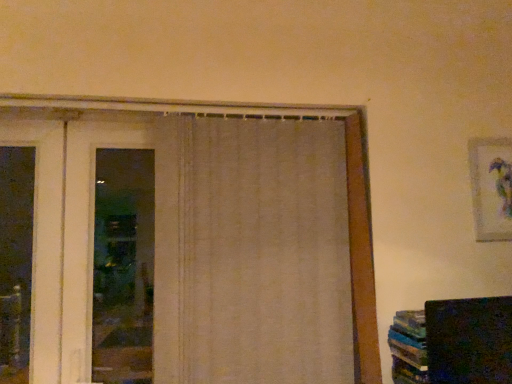
Question: From the image's perspective, is beige fabric curtain at center above or below white fabric door at left?

Choices:
 (A) below
 (B) above

Answer: (A)

Question: Considering their positions, is beige fabric curtain at center located in front of or behind white fabric door at left?

Choices:
 (A) behind
 (B) front

Answer: (B)

Question: Which of these objects is positioned closest to the white fabric door at left?

Choices:
 (A) beige fabric curtain at center
 (B) matte white picture frame at upper right

Answer: (A)

Question: Which object is positioned closest to the matte white picture frame at upper right?

Choices:
 (A) beige fabric curtain at center
 (B) white fabric door at left

Answer: (A)